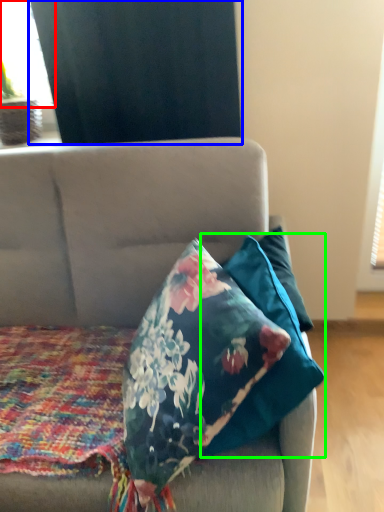
Question: Which object is positioned farthest from window screen (highlighted by a red box)? Select from curtain (highlighted by a blue box) and pillow (highlighted by a green box).

Choices:
 (A) curtain
 (B) pillow

Answer: (B)